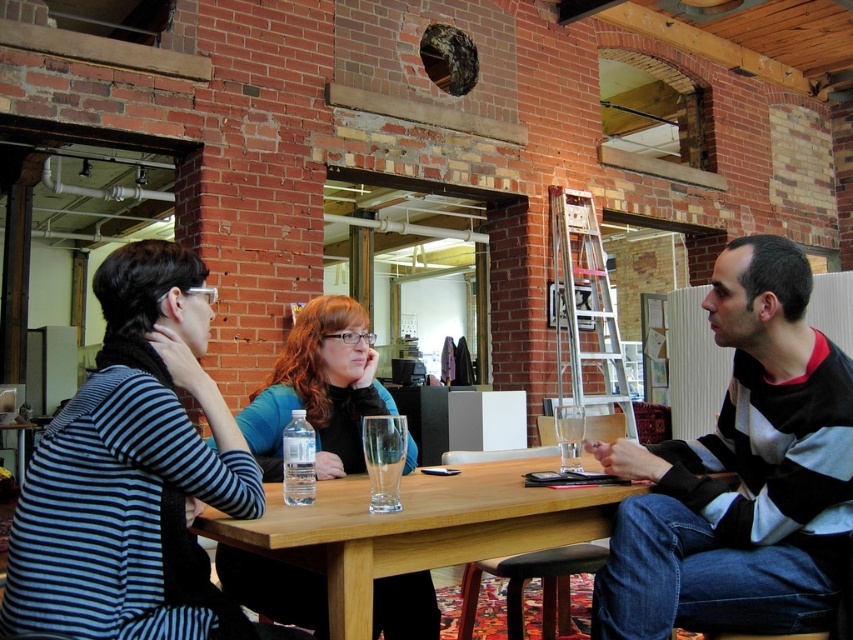
Question: Which object is positioned closest to the clear plastic bottle at table center?

Choices:
 (A) striped fabric shirt at left
 (B) blue matte shirt at center
 (C) striped sweater at center
 (D) wooden table at center

Answer: (B)

Question: Does clear plastic bottle at table center appear on the left side of transparent glass at table center?

Choices:
 (A) yes
 (B) no

Answer: (A)

Question: Is striped sweater at center below blue matte shirt at center?

Choices:
 (A) no
 (B) yes

Answer: (A)

Question: Which object appears closest to the camera in this image?

Choices:
 (A) blue matte shirt at center
 (B) striped fabric shirt at left
 (C) clear plastic bottle at table center

Answer: (B)

Question: Can you confirm if blue matte shirt at center is bigger than clear plastic bottle at table center?

Choices:
 (A) yes
 (B) no

Answer: (A)

Question: Among these points, which one is farthest from the camera?

Choices:
 (A) [370, 515]
 (B) [751, 461]
 (C) [293, 500]
 (D) [273, 476]

Answer: (D)